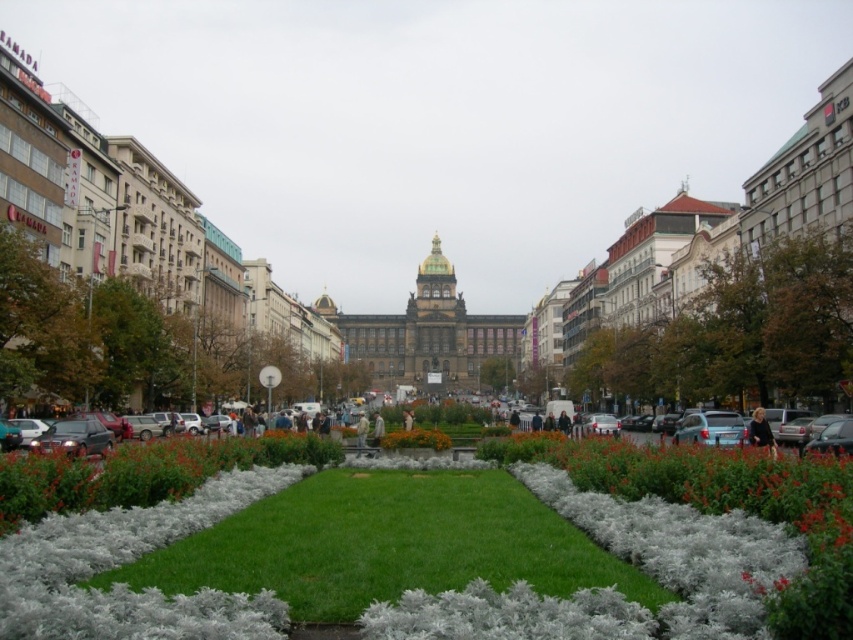
Question: Can you confirm if green grass at center is positioned above green soft grass at center?

Choices:
 (A) no
 (B) yes

Answer: (B)

Question: Is the position of green soft grass at center more distant than that of orange matte flower bed at center?

Choices:
 (A) yes
 (B) no

Answer: (B)

Question: Does green grass at center appear over orange matte flower bed at center?

Choices:
 (A) yes
 (B) no

Answer: (B)

Question: Which point is closer to the camera?

Choices:
 (A) green soft grass at center
 (B) orange matte flower bed at center

Answer: (A)

Question: Which object is closer to the camera taking this photo?

Choices:
 (A) orange matte flower bed at center
 (B) green soft grass at center
 (C) green grass at center

Answer: (C)

Question: Which point is farther to the camera?

Choices:
 (A) green soft grass at center
 (B) green grass at center

Answer: (A)